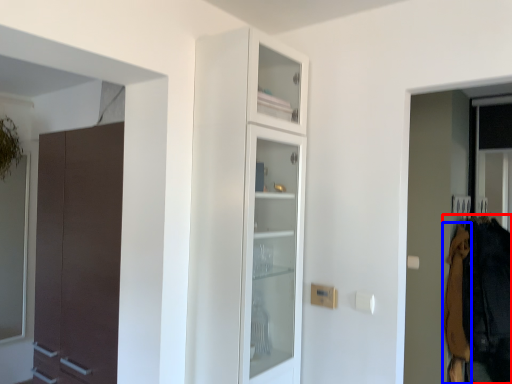
Question: Which of the following is the closest to the observer, clothing (highlighted by a red box) or clothing (highlighted by a blue box)?

Choices:
 (A) clothing
 (B) clothing

Answer: (A)